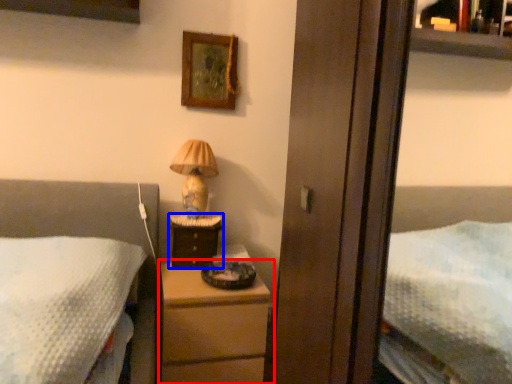
Question: Which object is further to the camera taking this photo, chest of drawers (highlighted by a red box) or nightstand (highlighted by a blue box)?

Choices:
 (A) chest of drawers
 (B) nightstand

Answer: (B)